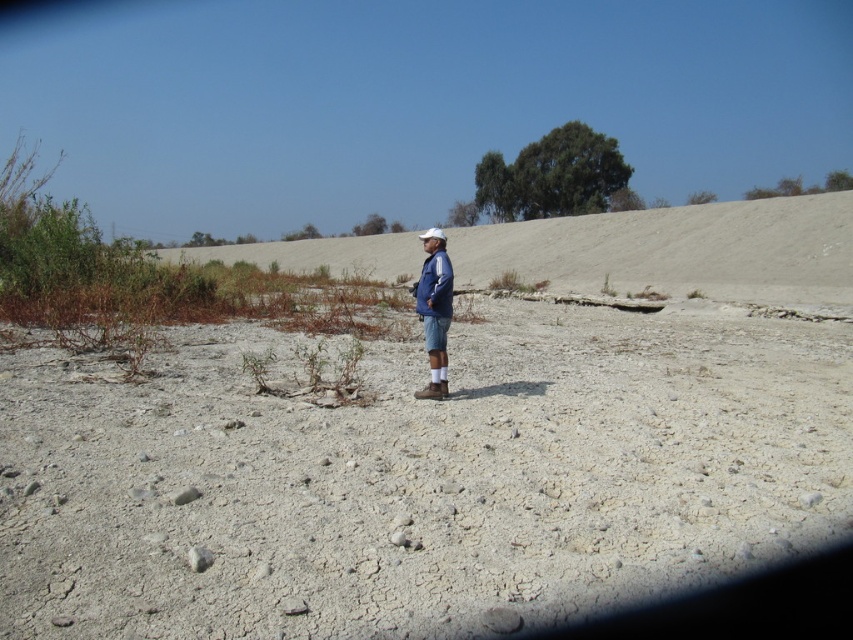
Between point (602, 250) and point (444, 253), which one is positioned in front?

Point (444, 253)

Is point (354, 236) positioned after point (445, 368)?

Yes, point (354, 236) is farther from viewer.

Is point (322, 241) more distant than point (437, 394)?

Yes, it is behind point (437, 394).

Where is `smooth sand hill at center`? smooth sand hill at center is located at coordinates (677, 250).

Which is more to the left, gray gravelly sand at center or blue denim jacket at center?

Positioned to the left is blue denim jacket at center.

Is gray gravelly sand at center below blue denim jacket at center?

Yes, gray gravelly sand at center is below blue denim jacket at center.

Who is more forward, (138, 413) or (444, 323)?

Point (138, 413) is more forward.

In order to click on gray gravelly sand at center in this screenshot , I will do `click(418, 477)`.

Is gray gravelly sand at center positioned at the back of smooth sand hill at center?

No.

Between gray gravelly sand at center and smooth sand hill at center, which one has more height?

Standing taller between the two is smooth sand hill at center.

Describe the element at coordinates (418, 477) in the screenshot. The image size is (853, 640). I see `gray gravelly sand at center` at that location.

The height and width of the screenshot is (640, 853). I want to click on gray gravelly sand at center, so (418, 477).